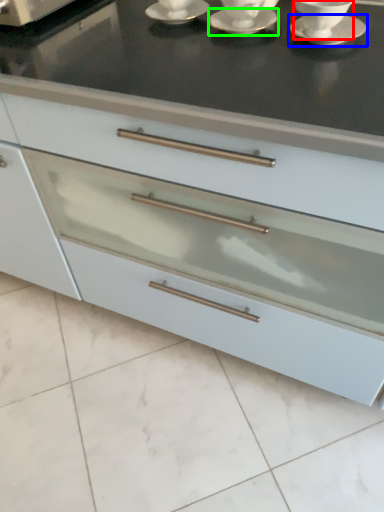
Question: Considering the real-world distances, which object is farthest from tableware (highlighted by a red box)? saucer (highlighted by a blue box) or saucer (highlighted by a green box)?

Choices:
 (A) saucer
 (B) saucer

Answer: (B)